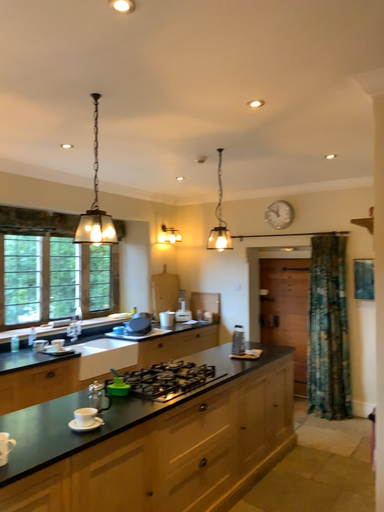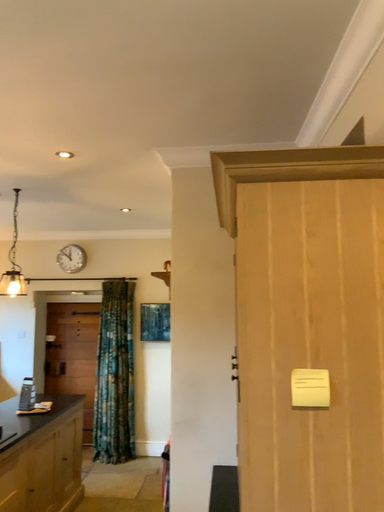
Question: Which way did the camera rotate in the video?

Choices:
 (A) rotated right
 (B) rotated left

Answer: (A)